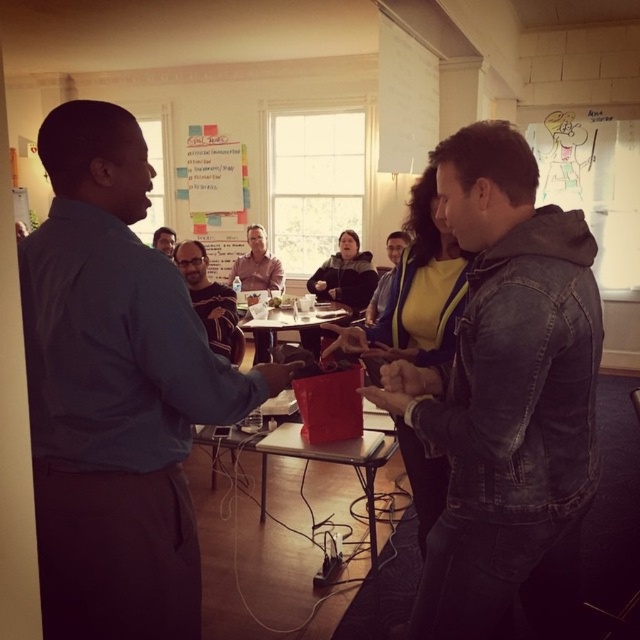
Who is more forward, (209, 289) or (168, 237)?

Point (209, 289) is in front.

Who is positioned more to the right, dark brown sweater at center or matte black shirt at center?

Positioned to the right is dark brown sweater at center.

This screenshot has width=640, height=640. What are the coordinates of `dark brown sweater at center` in the screenshot? It's located at (211, 301).

How far apart are white paper at upper center and metallic silver table at center?

white paper at upper center is 14.74 feet away from metallic silver table at center.

Is white paper at upper center above metallic silver table at center?

Yes.

Does point (204, 234) lie behind point (282, 436)?

Yes, point (204, 234) is farther from viewer.

Locate an element on the screen. The image size is (640, 640). white paper at upper center is located at coordinates (216, 195).

Does point (196, 291) come behind point (404, 244)?

Yes, it is.

This screenshot has width=640, height=640. What do you see at coordinates (211, 301) in the screenshot?
I see `dark brown sweater at center` at bounding box center [211, 301].

Who is more distant from viewer, [195,291] or [392,260]?

The point [392,260] is behind.

This screenshot has width=640, height=640. I want to click on dark brown sweater at center, so click(x=211, y=301).